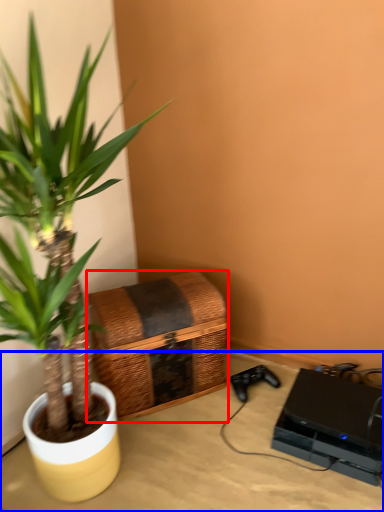
Question: Which object is further to the camera taking this photo, basket (highlighted by a red box) or table (highlighted by a blue box)?

Choices:
 (A) basket
 (B) table

Answer: (A)